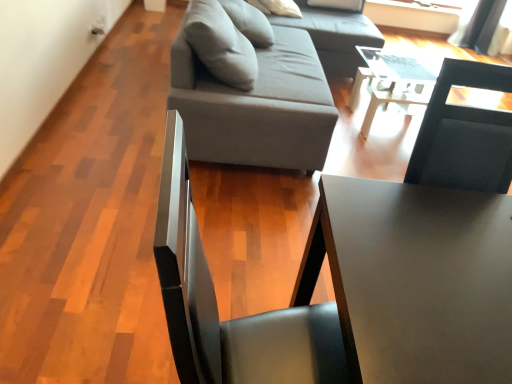
Question: Does white glossy table at center, acting as the second table starting from the bottom, have a greater height compared to gray fabric studio couch at upper center?

Choices:
 (A) yes
 (B) no

Answer: (B)

Question: Is white glossy table at center, arranged as the first table when viewed from the back, bigger than gray fabric studio couch at upper center?

Choices:
 (A) yes
 (B) no

Answer: (B)

Question: Are white glossy table at center, arranged as the first table when viewed from the back, and gray fabric studio couch at upper center beside each other?

Choices:
 (A) yes
 (B) no

Answer: (B)

Question: From the image's perspective, is white glossy table at center, acting as the second table starting from the bottom, located above gray fabric studio couch at upper center?

Choices:
 (A) yes
 (B) no

Answer: (B)

Question: Can you confirm if white glossy table at center, arranged as the first table when viewed from the back, is smaller than gray fabric studio couch at upper center?

Choices:
 (A) no
 (B) yes

Answer: (B)

Question: Is white glossy table at center, acting as the second table starting from the bottom, not within gray fabric studio couch at upper center?

Choices:
 (A) yes
 (B) no

Answer: (A)

Question: Is white glossy table at center, which is the first table in top-to-bottom order, smaller than matte black table at center, marked as the first table in a front-to-back arrangement?

Choices:
 (A) yes
 (B) no

Answer: (A)

Question: From a real-world perspective, is white glossy table at center, arranged as the first table when viewed from the back, physically above matte black table at center, acting as the second table starting from the back?

Choices:
 (A) no
 (B) yes

Answer: (A)

Question: Is white glossy table at center, which is the 2th table from front to back, with matte black table at center, acting as the second table starting from the back?

Choices:
 (A) yes
 (B) no

Answer: (B)

Question: Is white glossy table at center, which is the first table in top-to-bottom order, behind matte black table at center, acting as the second table starting from the back?

Choices:
 (A) no
 (B) yes

Answer: (B)

Question: Could you tell me if white glossy table at center, arranged as the first table when viewed from the back, is facing matte black table at center, marked as the first table in a front-to-back arrangement?

Choices:
 (A) no
 (B) yes

Answer: (A)

Question: Is the depth of white glossy table at center, which is the first table in top-to-bottom order, less than that of matte black table at center, which is the 1th table from bottom to top?

Choices:
 (A) no
 (B) yes

Answer: (A)

Question: Can you confirm if gray fabric studio couch at upper center is wider than matte black table at center, which is the 1th table from bottom to top?

Choices:
 (A) no
 (B) yes

Answer: (B)